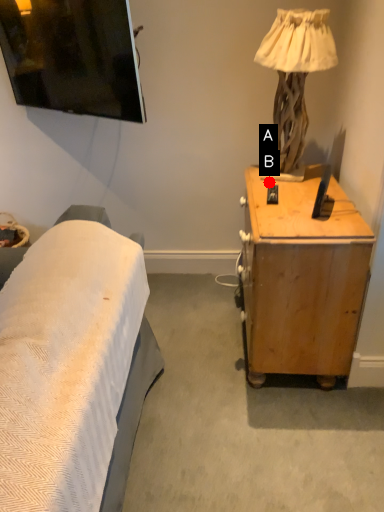
Question: Two points are circled on the image, labeled by A and B beside each circle. Which point is closer to the camera?

Choices:
 (A) A is closer
 (B) B is closer

Answer: (B)